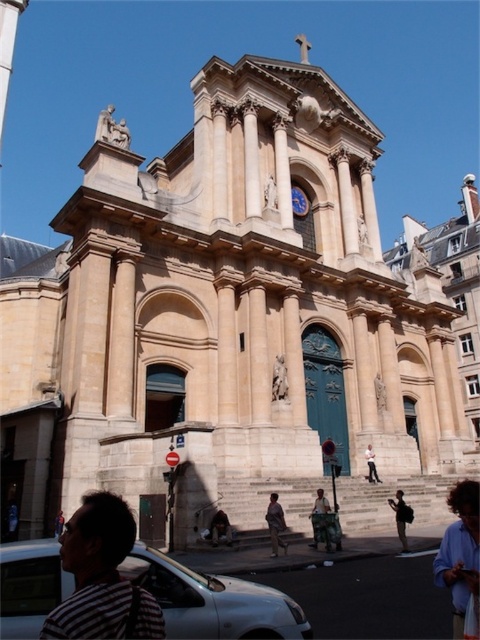
Question: Which point is closer to the camera?

Choices:
 (A) (11, 618)
 (B) (397, 529)
 (C) (276, 376)
 (D) (371, 481)

Answer: (A)

Question: Which object is farther from the camera taking this photo?

Choices:
 (A) brown leather jacket at lower center
 (B) smooth stone statue at center

Answer: (B)

Question: Is marble statue at center positioned in front of white cotton shirt at center?

Choices:
 (A) no
 (B) yes

Answer: (B)

Question: Does striped fabric at lower left have a smaller size compared to gold metallic clock at center?

Choices:
 (A) yes
 (B) no

Answer: (B)

Question: Which point appears farthest from the camera in this image?

Choices:
 (A) (57, 534)
 (B) (381, 410)
 (C) (370, 458)

Answer: (B)

Question: Where is light brown leather jacket at lower center located in relation to white cotton shirt at center in the image?

Choices:
 (A) left
 (B) right

Answer: (A)